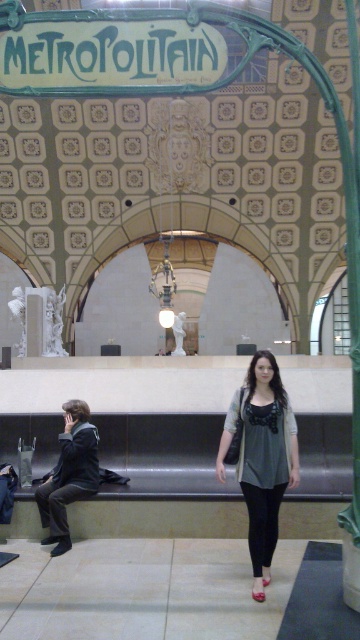
You are a fashion designer observing the matte gray blouse at center and the dark gray fabric jacket at left in the station. Which clothing item is positioned higher in the image?

The matte gray blouse at center is positioned higher than the dark gray fabric jacket at left, as it is located above it.

You are a fashion designer observing the matte gray blouse at center and the dark gray fabric jacket at left in the station. Which clothing item appears taller in the image?

The matte gray blouse at center appears much taller than the dark gray fabric jacket at left.